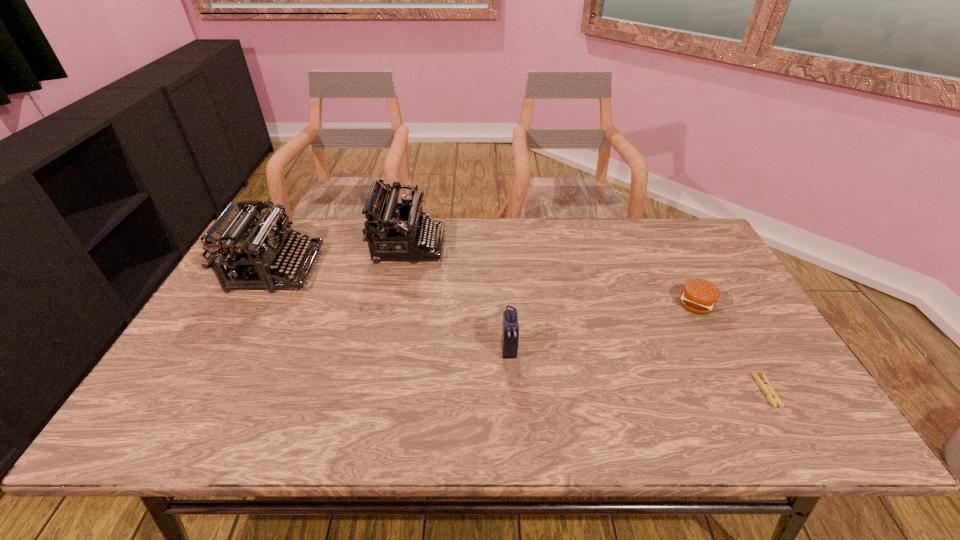
This screenshot has height=540, width=960. Identify the location of free area in between the leftmost object and the hamburger. (486, 286).

Locate an element on the screen. free space between the fourth object from right to left and the third object from right to left is located at coordinates (459, 298).

Find the location of a particular element. The width and height of the screenshot is (960, 540). vacant area between the left typewriter and the third object from right to left is located at coordinates (393, 309).

Where is `free spot between the hamburger and the shortest object`? This screenshot has width=960, height=540. free spot between the hamburger and the shortest object is located at coordinates (731, 347).

What are the coordinates of `the closest object to the shortest object` in the screenshot? It's located at (699, 296).

What are the coordinates of `the fourth closest object to the right typewriter` in the screenshot? It's located at (765, 385).

This screenshot has width=960, height=540. In order to click on free space that satisfies the following two spatial constraints: 1. on the keyboard of the second shortest object; 2. on the right side of the fourth object from right to left in this screenshot , I will do `click(396, 304)`.

Where is `free location that satisfies the following two spatial constraints: 1. on the typing side of the leftmost object; 2. on the left side of the hamburger`? The height and width of the screenshot is (540, 960). free location that satisfies the following two spatial constraints: 1. on the typing side of the leftmost object; 2. on the left side of the hamburger is located at coordinates (256, 304).

Where is `free spot that satisfies the following two spatial constraints: 1. on the keyboard of the right typewriter; 2. on the back side of the fourth tallest object`? Image resolution: width=960 pixels, height=540 pixels. free spot that satisfies the following two spatial constraints: 1. on the keyboard of the right typewriter; 2. on the back side of the fourth tallest object is located at coordinates (396, 304).

I want to click on vacant point that satisfies the following two spatial constraints: 1. on the keyboard of the fourth object from right to left; 2. on the back side of the fourth tallest object, so click(x=396, y=304).